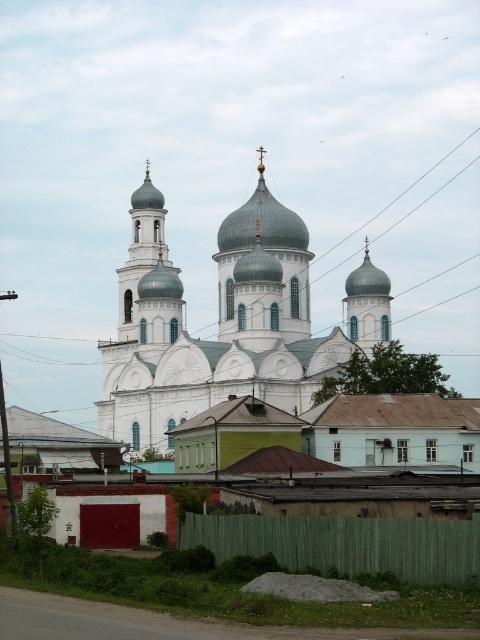
Does white stone church at center have a larger size compared to smooth silver dome at center?

Indeed, white stone church at center has a larger size compared to smooth silver dome at center.

Does white stone church at center appear over smooth silver dome at center?

Indeed, white stone church at center is positioned over smooth silver dome at center.

Is point (291, 291) in front of point (381, 330)?

Yes, point (291, 291) is closer to viewer.

Locate an element on the screen. The height and width of the screenshot is (640, 480). white stone church at center is located at coordinates (225, 321).

Can you confirm if white stone dome at center is positioned to the left of smooth silver dome at center?

Yes, white stone dome at center is to the left of smooth silver dome at center.

How much distance is there between white stone dome at center and smooth silver dome at center?

A distance of 7.75 meters exists between white stone dome at center and smooth silver dome at center.

What do you see at coordinates (263, 269) in the screenshot? The width and height of the screenshot is (480, 640). I see `white stone dome at center` at bounding box center [263, 269].

What are the coordinates of `white stone dome at center` in the screenshot? It's located at (263, 269).

Can you confirm if white stone church at center is positioned to the left of white stone dome at center?

Correct, you'll find white stone church at center to the left of white stone dome at center.

Is white stone church at center behind white stone dome at center?

No, it is in front of white stone dome at center.

Locate an element on the screen. This screenshot has height=640, width=480. white stone church at center is located at coordinates tap(225, 321).